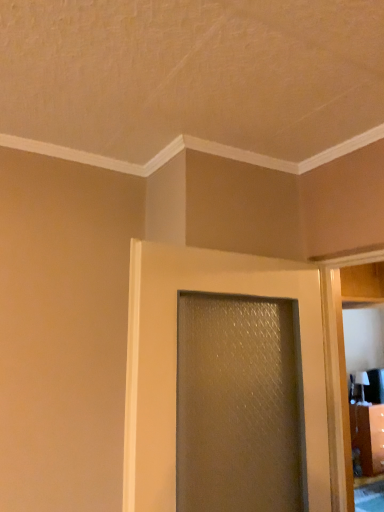
In order to click on matte white elevator at right in this screenshot , I will do `click(344, 370)`.

Describe the element at coordinates (344, 370) in the screenshot. I see `matte white elevator at right` at that location.

Locate an element on the screen. This screenshot has height=512, width=384. satin gold textured door at center is located at coordinates (176, 360).

This screenshot has width=384, height=512. Describe the element at coordinates (176, 360) in the screenshot. I see `satin gold textured door at center` at that location.

In the scene shown: What is the approximate height of satin gold textured door at center?

The height of satin gold textured door at center is 38.07 inches.

Identify the location of matte white elevator at right. (344, 370).

Between matte white elevator at right and satin gold textured door at center, which one appears on the right side from the viewer's perspective?

From the viewer's perspective, matte white elevator at right appears more on the right side.

Is matte white elevator at right positioned in front of satin gold textured door at center?

No, matte white elevator at right is further to the viewer.

Which is closer, (359, 287) or (186, 257)?

The point (186, 257) is in front.

From the image's perspective, would you say matte white elevator at right is positioned over satin gold textured door at center?

No, from the image's perspective, matte white elevator at right is not on top of satin gold textured door at center.

From a real-world perspective, is matte white elevator at right positioned over satin gold textured door at center based on gravity?

Incorrect, from a real-world perspective, matte white elevator at right is lower than satin gold textured door at center.

Does matte white elevator at right have a greater width compared to satin gold textured door at center?

Incorrect, the width of matte white elevator at right does not surpass that of satin gold textured door at center.

From the picture: Can you confirm if matte white elevator at right is taller than satin gold textured door at center?

Yes.

Looking at this image, considering the relative sizes of matte white elevator at right and satin gold textured door at center in the image provided, is matte white elevator at right smaller than satin gold textured door at center?

Yes, matte white elevator at right is smaller than satin gold textured door at center.

Is satin gold textured door at center a part of matte white elevator at right?

No, satin gold textured door at center is located outside of matte white elevator at right.

Would you consider matte white elevator at right to be distant from satin gold textured door at center?

That's not correct — matte white elevator at right is a little close to satin gold textured door at center.

Is matte white elevator at right facing away from satin gold textured door at center?

That's not correct — matte white elevator at right is not looking away from satin gold textured door at center.

How different are the orientations of matte white elevator at right and satin gold textured door at center in degrees?

They differ by 94.4 degrees in their facing directions.

Where is `door above the matte white elevator at right (from a real-world perspective)`? The width and height of the screenshot is (384, 512). door above the matte white elevator at right (from a real-world perspective) is located at coordinates (176, 360).

Does satin gold textured door at center appear on the left side of matte white elevator at right?

Indeed, satin gold textured door at center is positioned on the left side of matte white elevator at right.

Considering the positions of objects satin gold textured door at center and matte white elevator at right in the image provided, who is behind, satin gold textured door at center or matte white elevator at right?

matte white elevator at right is behind.

Considering the positions of point (142, 313) and point (357, 271), is point (142, 313) closer or farther from the camera than point (357, 271)?

Point (142, 313).

From the image's perspective, between satin gold textured door at center and matte white elevator at right, which one is located above?

satin gold textured door at center is shown above in the image.

From a real-world perspective, is satin gold textured door at center beneath matte white elevator at right?

No, from a real-world perspective, satin gold textured door at center is not beneath matte white elevator at right.

From the picture: Which of these two, satin gold textured door at center or matte white elevator at right, is thinner?

With smaller width is matte white elevator at right.

Which of these two, satin gold textured door at center or matte white elevator at right, stands shorter?

satin gold textured door at center is shorter.

Considering the sizes of objects satin gold textured door at center and matte white elevator at right in the image provided, who is bigger, satin gold textured door at center or matte white elevator at right?

satin gold textured door at center.

Is satin gold textured door at center inside the boundaries of matte white elevator at right, or outside?

satin gold textured door at center is spatially situated outside matte white elevator at right.

Is satin gold textured door at center with matte white elevator at right?

No, satin gold textured door at center is not making contact with matte white elevator at right.

Could you tell me if satin gold textured door at center is turned towards matte white elevator at right?

No, satin gold textured door at center is not turned towards matte white elevator at right.

How different are the orientations of satin gold textured door at center and matte white elevator at right in degrees?

satin gold textured door at center and matte white elevator at right are facing 94.4 degrees away from each other.

Consider the image. Measure the distance between satin gold textured door at center and matte white elevator at right.

satin gold textured door at center is 16.99 inches away from matte white elevator at right.

Find the location of a particular element. door in front of the matte white elevator at right is located at coordinates (176, 360).

The height and width of the screenshot is (512, 384). I want to click on door in front of the matte white elevator at right, so coord(176,360).

Identify the location of elevator beneath the satin gold textured door at center (from a real-world perspective). (344, 370).